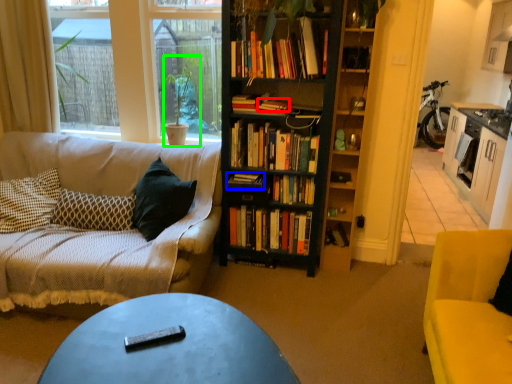
Question: Which object is positioned closest to book (highlighted by a red box)? Select from book (highlighted by a blue box) and houseplant (highlighted by a green box).

Choices:
 (A) book
 (B) houseplant

Answer: (A)